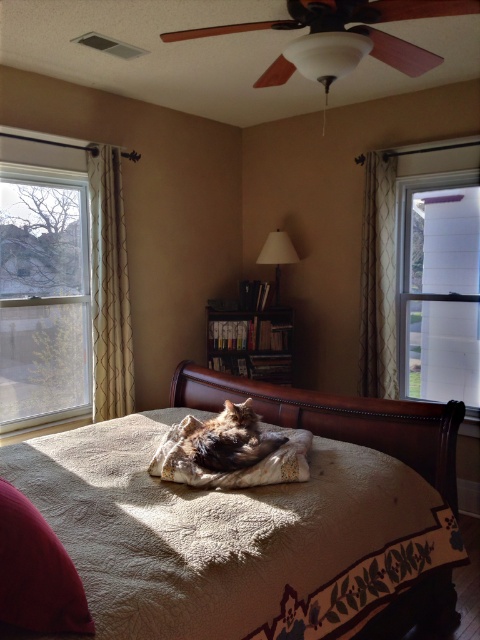
From the picture: What is the object located at the coordinates point (61, 282) in the scene?

The point (61, 282) indicates clear glass window at left.

You are standing in the bedroom and want to let in more natural light. Which object between the clear glass window at left and the beige textured curtain at right should you adjust to achieve this?

The clear glass window at left is taller than the beige textured curtain at right, so adjusting the clear glass window at left would allow more natural light into the room since it has a larger opening.